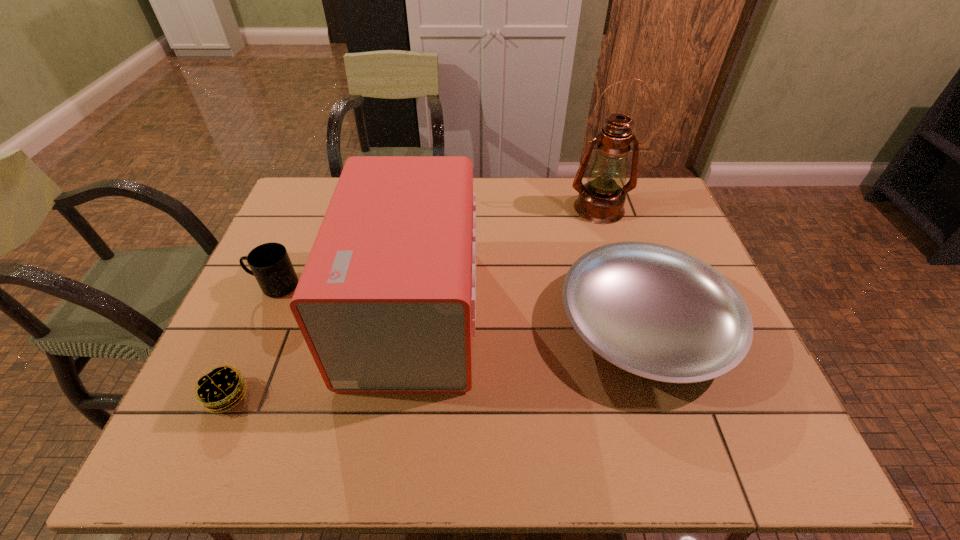
Image resolution: width=960 pixels, height=540 pixels. Find the location of `the farthest object`. the farthest object is located at coordinates (601, 200).

Where is `the tallest object`? the tallest object is located at coordinates (601, 200).

Find the location of a particular element. This screenshot has height=540, width=960. box is located at coordinates (386, 302).

Where is `the second tallest object`? The image size is (960, 540). the second tallest object is located at coordinates (386, 302).

Find the location of `the third shortest object`. the third shortest object is located at coordinates (270, 263).

What are the coordinates of `bedpan` in the screenshot? It's located at (655, 311).

You are a GUI agent. You are given a task and a screenshot of the screen. Output one action in this format:
    pyautogui.click(x=<x>, y=<y>)
    Task: Click on the patty
    
    Given the screenshot: What is the action you would take?
    pyautogui.click(x=215, y=389)

Identify the location of free space located on the front of the oil lamp. This screenshot has width=960, height=540. (616, 265).

Where is `free space located on the surface of the box where the text is embossed`? free space located on the surface of the box where the text is embossed is located at coordinates (566, 312).

You are a GUI agent. You are given a task and a screenshot of the screen. Output one action in this format:
    pyautogui.click(x=<x>, y=<y>)
    Task: Click on the free space located on the left of the bedpan
    
    Given the screenshot: What is the action you would take?
    pyautogui.click(x=506, y=325)